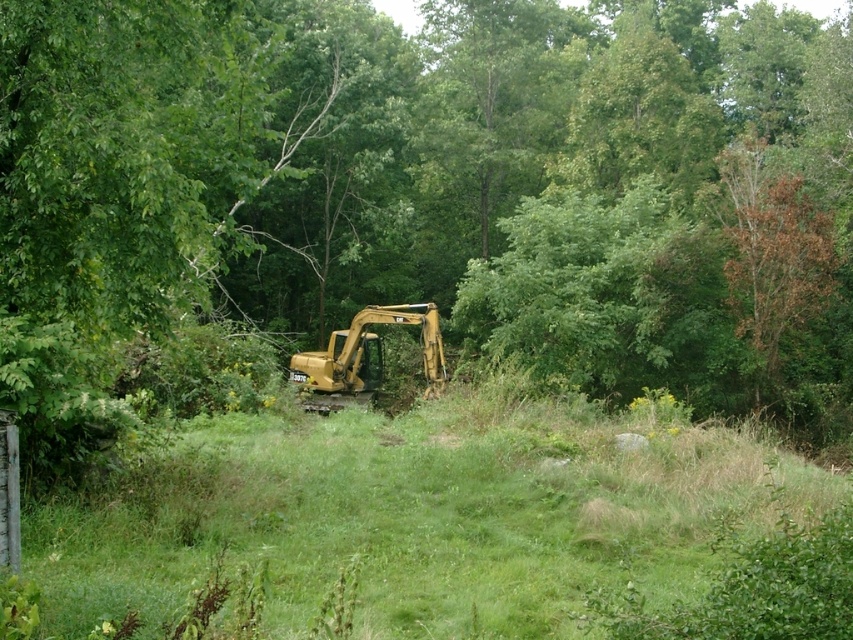
Is green grass at center to the right of yellow metallic excavator at center from the viewer's perspective?

Indeed, green grass at center is positioned on the right side of yellow metallic excavator at center.

Who is positioned more to the right, green grass at center or yellow metallic excavator at center?

green grass at center is more to the right.

Who is more forward, (676, 461) or (373, 380)?

Positioned in front is point (676, 461).

This screenshot has width=853, height=640. I want to click on green grass at center, so click(422, 518).